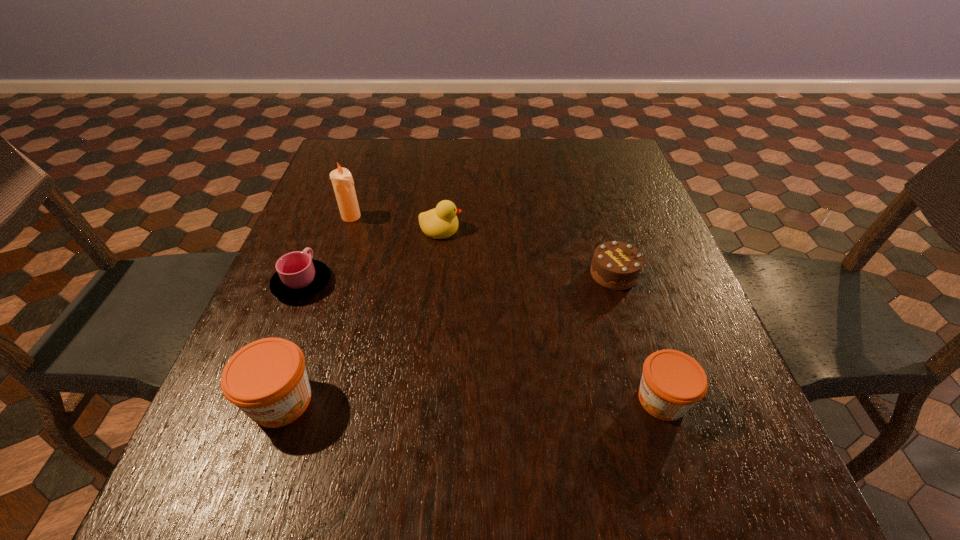
This screenshot has height=540, width=960. I want to click on the taller jam, so click(x=267, y=379).

Find the location of a particular element. This screenshot has width=960, height=540. the left jam is located at coordinates (267, 379).

Image resolution: width=960 pixels, height=540 pixels. I want to click on the right jam, so click(672, 382).

Image resolution: width=960 pixels, height=540 pixels. What are the coordinates of `candle` in the screenshot? It's located at (342, 181).

At what (x,y) coordinates should I click in order to perform the action: click on the third object from right to left. Please return your answer as a coordinate pair (x, y). The height and width of the screenshot is (540, 960). Looking at the image, I should click on (441, 222).

Locate an element on the screen. The height and width of the screenshot is (540, 960). cup is located at coordinates (298, 276).

Identify the location of chocolate cake. The image size is (960, 540). (615, 265).

This screenshot has height=540, width=960. I want to click on free space located 0.210m on the front label of the right jam, so click(511, 400).

Image resolution: width=960 pixels, height=540 pixels. Find the location of `blank space located 0.060m on the front label of the right jam`. blank space located 0.060m on the front label of the right jam is located at coordinates 598,400.

Where is `free region located 0.330m on the front label of the right jam`? The height and width of the screenshot is (540, 960). free region located 0.330m on the front label of the right jam is located at coordinates (441, 400).